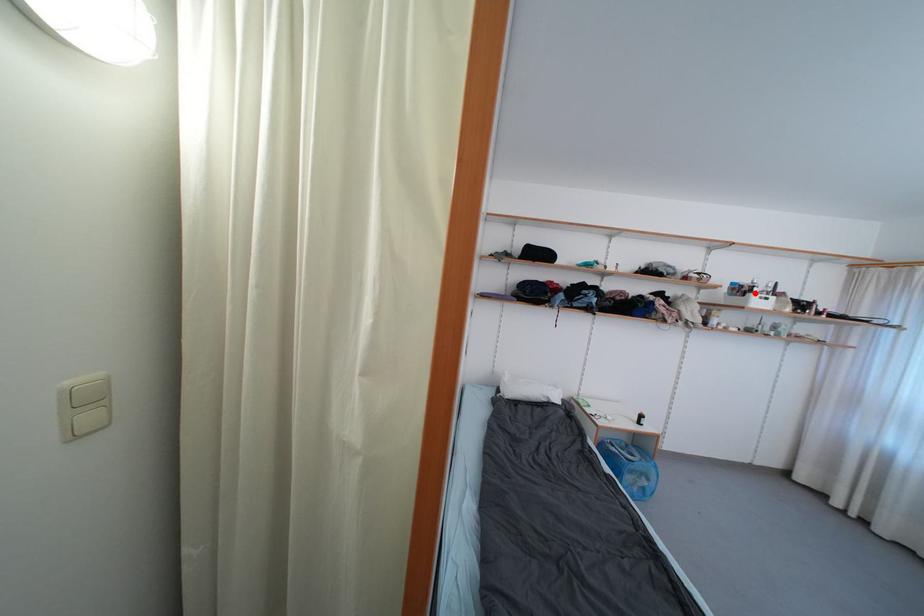
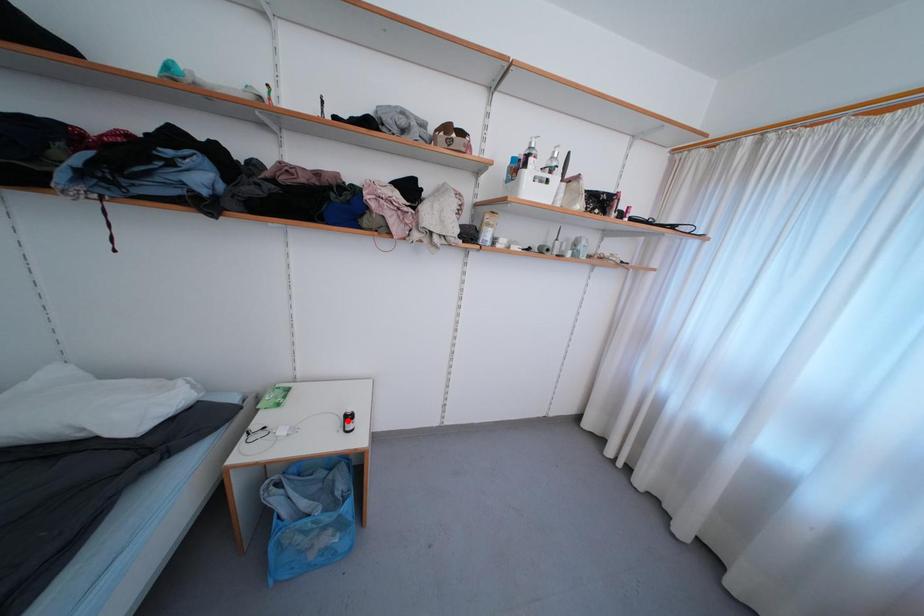
I am providing you with two images of the same scene from different viewpoints. A red point is marked on the first image and another point is marked on the second image. Is the marked point in image1 the same physical position as the marked point in image2?

No